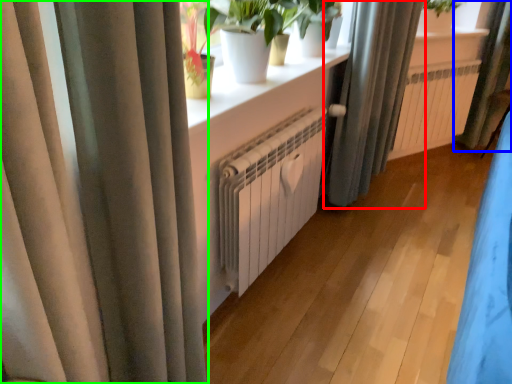
Question: Estimate the real-world distances between objects in this image. Which object is closer to curtain (highlighted by a red box), curtain (highlighted by a blue box) or curtain (highlighted by a green box)?

Choices:
 (A) curtain
 (B) curtain

Answer: (A)